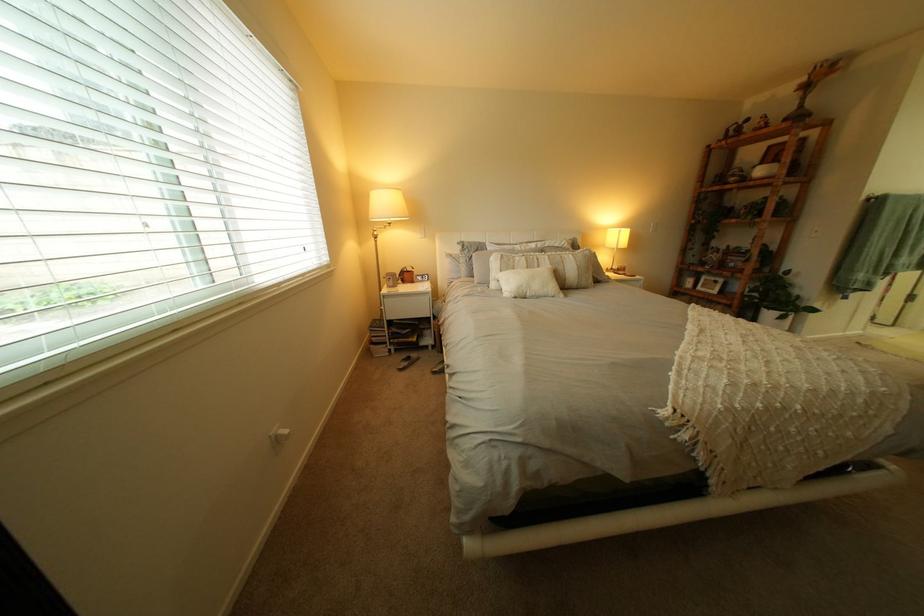
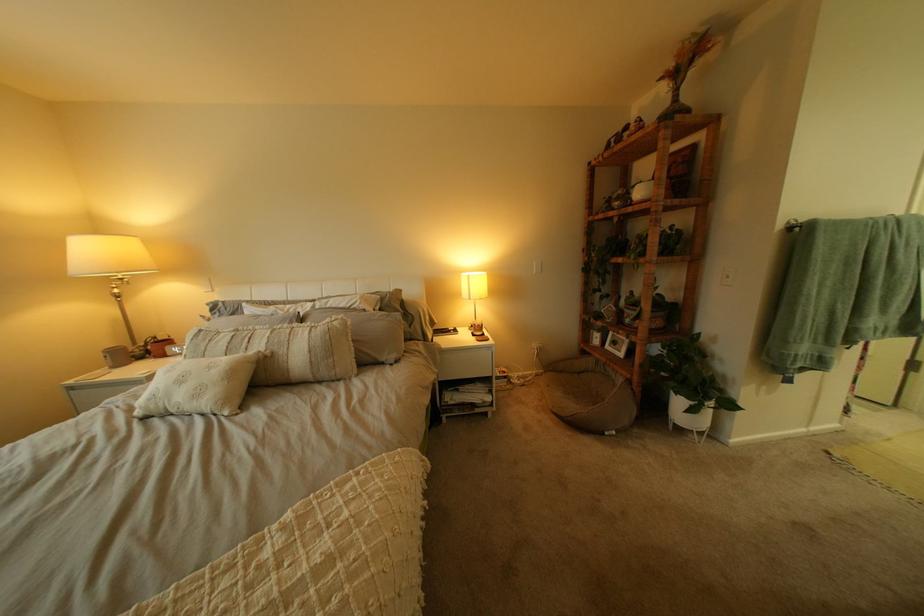
In the second image, find the point that corresponds to (564,264) in the first image.

(281, 342)